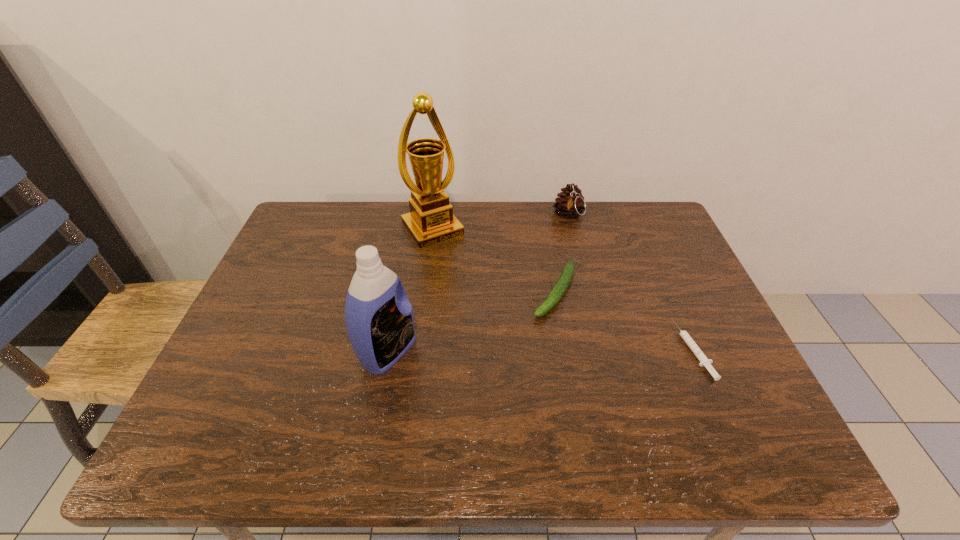
I want to click on detergent, so click(x=380, y=325).

Find the location of a particular element. This screenshot has height=540, width=960. syringe is located at coordinates (704, 361).

Image resolution: width=960 pixels, height=540 pixels. I want to click on the shortest object, so click(x=704, y=361).

This screenshot has height=540, width=960. Find the location of `award`. award is located at coordinates (431, 221).

This screenshot has height=540, width=960. Identify the location of the second shortest object. (561, 286).

This screenshot has width=960, height=540. In order to click on pinecone in this screenshot , I will do `click(569, 203)`.

Locate an element on the screen. The image size is (960, 540). vacant position located 0.110m on the right of the fourth shortest object is located at coordinates (463, 352).

The width and height of the screenshot is (960, 540). I want to click on vacant space positioned on the back of the rightmost object, so click(644, 238).

In order to click on free spot located on the front-facing side of the tallest object in this screenshot , I will do `click(504, 325)`.

You are a GUI agent. You are given a task and a screenshot of the screen. Output one action in this format:
    pyautogui.click(x=<x>, y=<y>)
    Task: Click on the vacant area situated 0.130m on the front-facing side of the tallest object
    
    Given the screenshot: What is the action you would take?
    pyautogui.click(x=466, y=274)